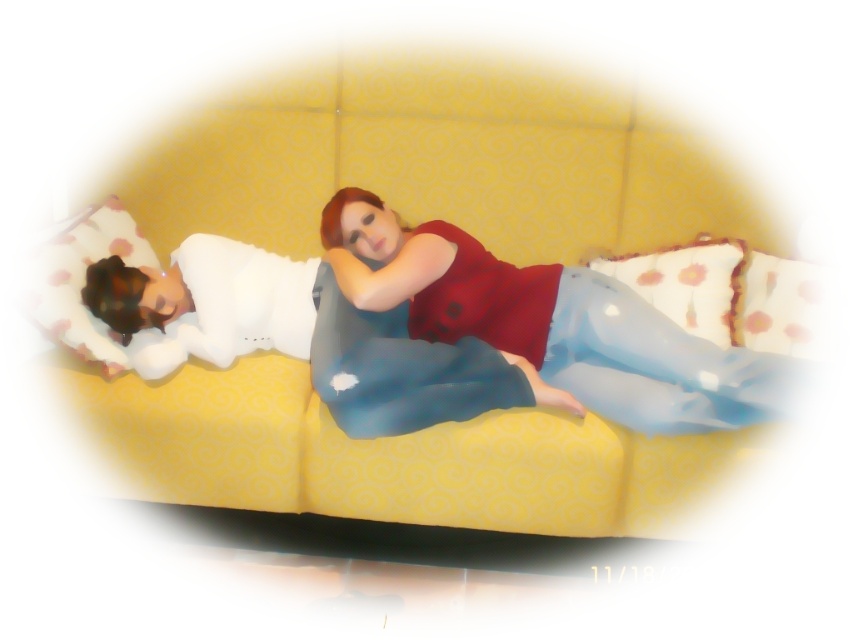
Between point (428, 483) and point (753, 400), which one is positioned behind?

Point (428, 483)

Is yellow fabric couch at center below matte red blouse at center?

Indeed, yellow fabric couch at center is positioned under matte red blouse at center.

Between point (704, 435) and point (717, 369), which one is positioned behind?

The point (704, 435) is behind.

Identify the location of yellow fabric couch at center. Image resolution: width=853 pixels, height=640 pixels. (332, 419).

Is point (579, 385) farther from viewer compared to point (720, 339)?

No.

Which of these two, matte red blouse at center or white dotted fabric pillow at upper right, stands shorter?

white dotted fabric pillow at upper right is shorter.

Who is more distant from viewer, (573, 381) or (723, 294)?

Point (723, 294)

You are a GUI agent. You are given a task and a screenshot of the screen. Output one action in this format:
    pyautogui.click(x=<x>, y=<y>)
    Task: Click on the matte red blouse at center
    This screenshot has width=853, height=640.
    Given the screenshot: What is the action you would take?
    pyautogui.click(x=553, y=323)

Who is positioned more to the right, yellow fabric couch at center or white dotted fabric pillow at upper right?

white dotted fabric pillow at upper right is more to the right.

In the scene shown: Is yellow fabric couch at center to the right of white dotted fabric pillow at upper right from the viewer's perspective?

In fact, yellow fabric couch at center is to the left of white dotted fabric pillow at upper right.

This screenshot has height=640, width=853. In order to click on yellow fabric couch at center in this screenshot , I will do `click(332, 419)`.

This screenshot has height=640, width=853. I want to click on yellow fabric couch at center, so click(332, 419).